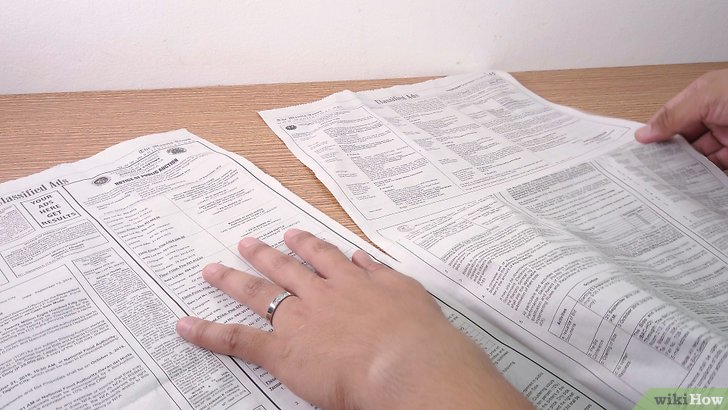
Where is `news paper`? This screenshot has width=728, height=410. news paper is located at coordinates (183, 263), (494, 171).